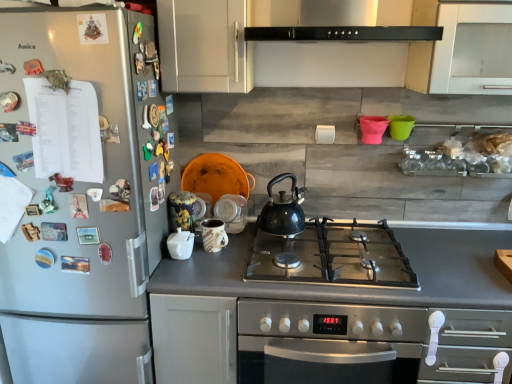
At what (x,y) coordinates should I click in order to perform the action: click on free location in front of matte ceramic mug at center, which is counted as the second appliance, starting from the back. Please return your answer as a coordinate pair (x, y). The image size is (512, 384). Looking at the image, I should click on (205, 272).